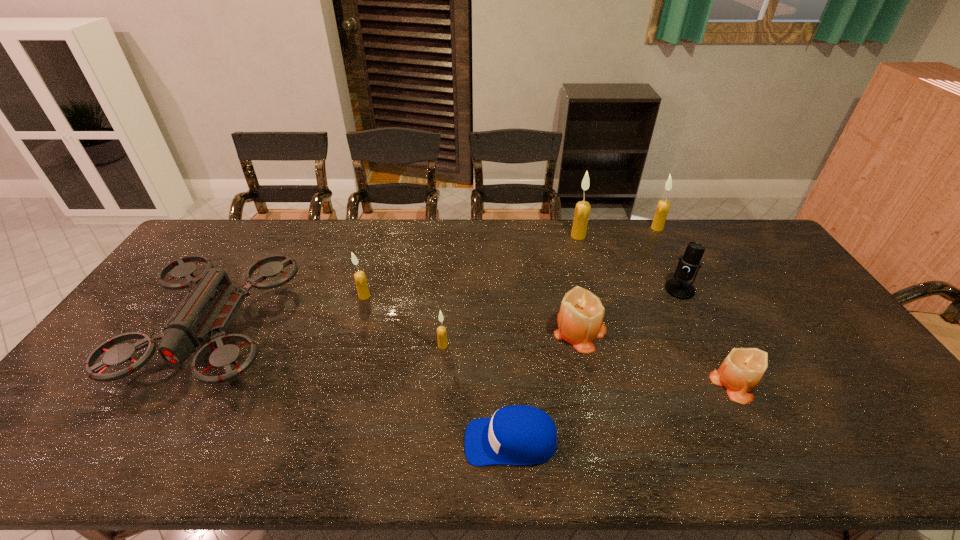
Find the location of a particular element. The height and width of the screenshot is (540, 960). the third nearest cream candle is located at coordinates (582, 210).

Identify the location of the tallest candle. [x=582, y=210].

Find the location of a particular element. the second tallest candle is located at coordinates (663, 206).

In order to click on the eighth shortest object in this screenshot , I will do `click(663, 206)`.

The width and height of the screenshot is (960, 540). I want to click on the leftmost candle, so click(361, 282).

This screenshot has width=960, height=540. In order to click on the second smallest cream candle in this screenshot , I will do `click(361, 282)`.

This screenshot has height=540, width=960. I want to click on microphone, so click(679, 288).

Locate an element on the screen. The image size is (960, 540). the left beige candle is located at coordinates (580, 320).

Where is `the bigger beige candle`? the bigger beige candle is located at coordinates (580, 320).

At what (x,y) coordinates should I click in order to perform the action: click on drone. Please return your answer as a coordinate pair (x, y). This screenshot has width=960, height=540. Looking at the image, I should click on (207, 310).